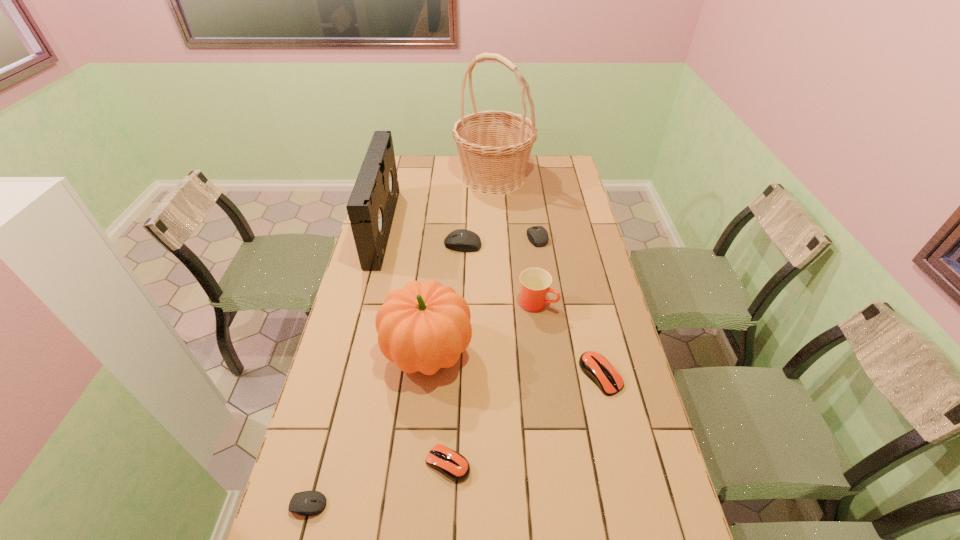
The width and height of the screenshot is (960, 540). Identify the location of the right orange computer mouse. (595, 366).

The height and width of the screenshot is (540, 960). Find the location of `the rightmost black computer equipment`. the rightmost black computer equipment is located at coordinates (537, 235).

You are a GUI agent. You are given a task and a screenshot of the screen. Output one action in this format:
    pyautogui.click(x=<x>, y=<y>)
    Task: Click on the second computer equipment from right to left
    This screenshot has height=540, width=960.
    Given the screenshot: What is the action you would take?
    click(537, 235)

The height and width of the screenshot is (540, 960). I want to click on the smaller orange computer mouse, so click(x=453, y=465).

This screenshot has width=960, height=540. I want to click on the nearer orange computer mouse, so [453, 465].

Where is `the smallest black computer equipment`? The height and width of the screenshot is (540, 960). the smallest black computer equipment is located at coordinates (306, 503).

The width and height of the screenshot is (960, 540). Find the location of `the leftmost computer equipment`. the leftmost computer equipment is located at coordinates (306, 503).

The width and height of the screenshot is (960, 540). Identify the location of blank space located 0.050m on the front of the tallest object. (495, 207).

The width and height of the screenshot is (960, 540). I want to click on vacant space located 0.370m on the side of the videotape with visible spindles, so tap(481, 227).

The width and height of the screenshot is (960, 540). In order to click on free space located 0.390m on the right of the orange pumpkin in this screenshot , I will do `click(597, 351)`.